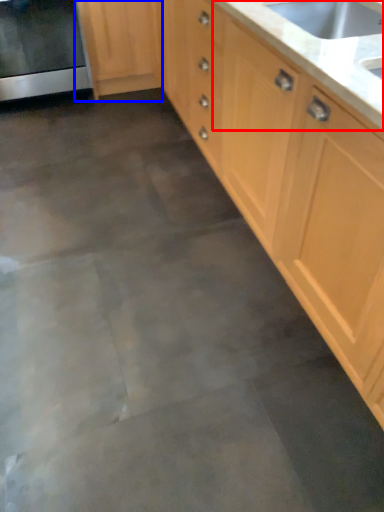
Question: Among these objects, which one is farthest to the camera, countertop (highlighted by a red box) or cabinetry (highlighted by a blue box)?

Choices:
 (A) countertop
 (B) cabinetry

Answer: (B)